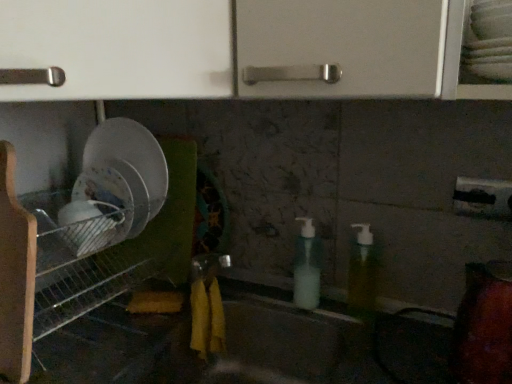
Question: Is metallic wire rack at left taller than translucent plastic soap dispenser at center, which appears as the second soap dispenser when viewed from the right?

Choices:
 (A) no
 (B) yes

Answer: (B)

Question: Is metallic wire rack at left positioned behind translucent plastic soap dispenser at center, which appears as the second soap dispenser when viewed from the right?

Choices:
 (A) yes
 (B) no

Answer: (B)

Question: Is metallic wire rack at left turned away from translucent plastic soap dispenser at center, which is counted as the 1th soap dispenser, starting from the left?

Choices:
 (A) no
 (B) yes

Answer: (A)

Question: Are metallic wire rack at left and translucent plastic soap dispenser at center, which is counted as the 1th soap dispenser, starting from the left, far apart?

Choices:
 (A) yes
 (B) no

Answer: (B)

Question: From the image's perspective, is metallic wire rack at left over translucent plastic soap dispenser at center, which is counted as the 1th soap dispenser, starting from the left?

Choices:
 (A) no
 (B) yes

Answer: (A)

Question: From the image's perspective, relative to translucent plastic soap dispenser at center, which is counted as the 1th soap dispenser, starting from the left, is matte gray sink at center above or below?

Choices:
 (A) above
 (B) below

Answer: (B)

Question: Considering the positions of point (286, 372) and point (293, 304), is point (286, 372) closer or farther from the camera than point (293, 304)?

Choices:
 (A) closer
 (B) farther

Answer: (B)

Question: Looking at their shapes, would you say matte gray sink at center is wider or thinner than translucent plastic soap dispenser at center, which is counted as the 1th soap dispenser, starting from the left?

Choices:
 (A) wide
 (B) thin

Answer: (A)

Question: Is matte gray sink at center taller or shorter than translucent plastic soap dispenser at center, which appears as the second soap dispenser when viewed from the right?

Choices:
 (A) short
 (B) tall

Answer: (B)

Question: From a real-world perspective, relative to matte gray sink at center, is metallic wire rack at left vertically above or below?

Choices:
 (A) below
 (B) above

Answer: (B)

Question: From the image's perspective, relative to matte gray sink at center, is metallic wire rack at left above or below?

Choices:
 (A) above
 (B) below

Answer: (A)

Question: Relative to matte gray sink at center, is metallic wire rack at left in front or behind?

Choices:
 (A) behind
 (B) front

Answer: (A)

Question: Is metallic wire rack at left inside or outside of matte gray sink at center?

Choices:
 (A) inside
 (B) outside

Answer: (B)

Question: In terms of width, does matte gray sink at center look wider or thinner when compared to translucent plastic soap dispenser at center, the second soap dispenser in the left-to-right sequence?

Choices:
 (A) wide
 (B) thin

Answer: (A)

Question: From the image's perspective, is matte gray sink at center positioned above or below translucent plastic soap dispenser at center, the second soap dispenser in the left-to-right sequence?

Choices:
 (A) below
 (B) above

Answer: (A)